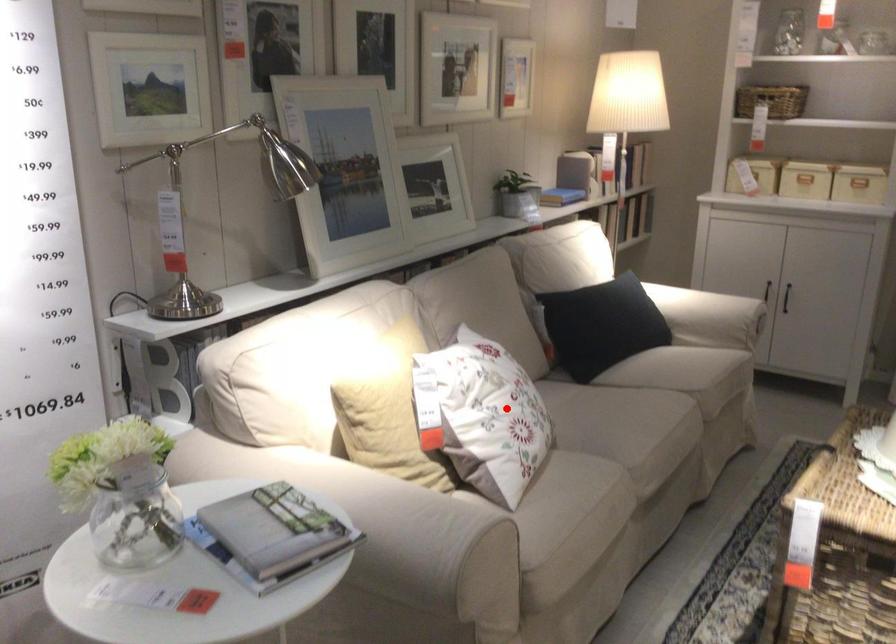
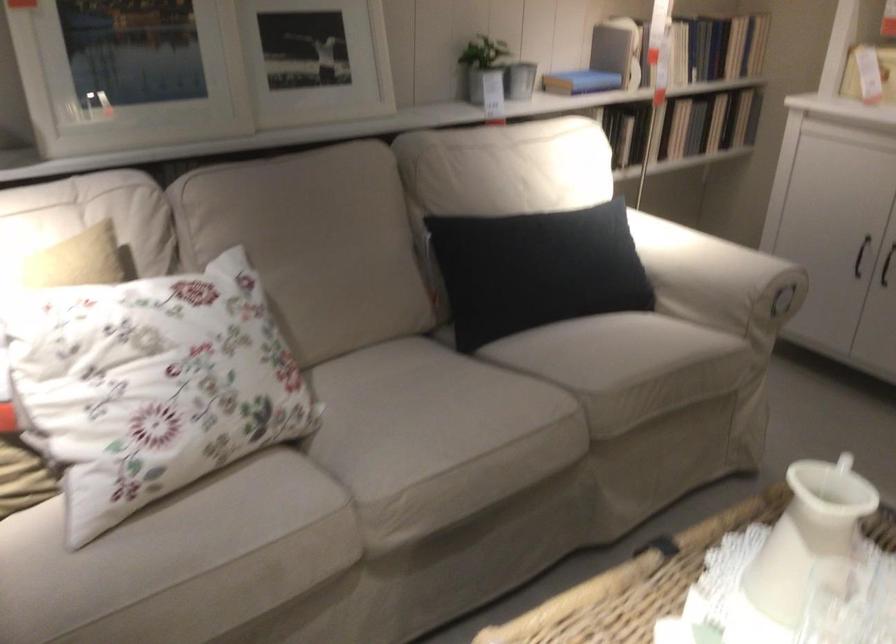
Question: I am providing you with two images of the same scene from different viewpoints. Image1 has a red point marked. In image2, the corresponding 3D location appears at what relative position? Reply with the corresponding letter.

Choices:
 (A) Closer
 (B) Farther

Answer: (A)